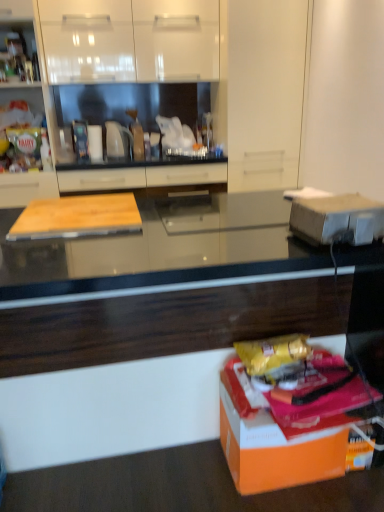
Find the location of a particular element. Image resolution: width=384 pixels, height=512 pixels. vacant area situated to the left side of white cardboard box at right, the second cardboard box in the bottom-to-top sequence is located at coordinates (256, 230).